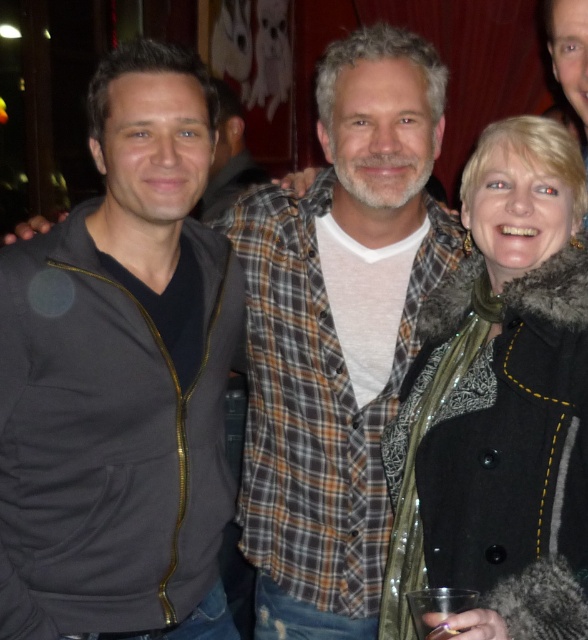
Question: Where is matte black jacket at left located in relation to fur-lined coat at center in the image?

Choices:
 (A) below
 (B) above

Answer: (B)

Question: Which of the following is the closest to the observer?

Choices:
 (A) fur-lined coat at center
 (B) matte black jacket at left

Answer: (A)

Question: Which object appears farthest from the camera in this image?

Choices:
 (A) matte black jacket at left
 (B) fur-lined coat at center

Answer: (A)

Question: Is the position of matte black jacket at left less distant than that of fur-lined coat at center?

Choices:
 (A) no
 (B) yes

Answer: (A)

Question: Considering the relative positions of matte black jacket at left and fur-lined coat at center in the image provided, where is matte black jacket at left located with respect to fur-lined coat at center?

Choices:
 (A) below
 (B) above

Answer: (B)